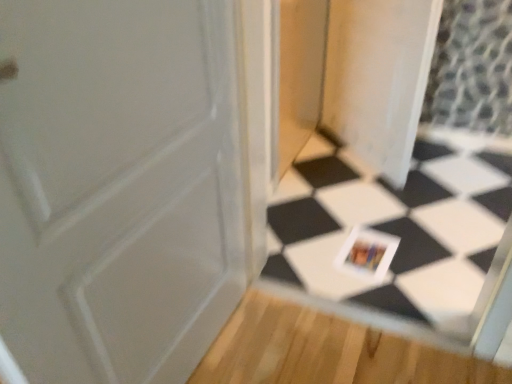
What do you see at coordinates (367, 253) in the screenshot?
I see `white glossy postcard at center` at bounding box center [367, 253].

What do you see at coordinates (396, 227) in the screenshot? This screenshot has height=384, width=512. I see `white glossy tile at center` at bounding box center [396, 227].

Image resolution: width=512 pixels, height=384 pixels. I want to click on transparent plastic screen door at center, so click(378, 78).

Is white glossy tile at center positioned with its back to white glossy postcard at center?

Yes, white glossy postcard at center is at the back of white glossy tile at center.

Is white glossy tile at center surrounding white glossy postcard at center?

Actually, white glossy postcard at center is outside white glossy tile at center.

Which object is positioned more to the right, white glossy tile at center or white glossy postcard at center?

white glossy postcard at center.

From the picture: In terms of height, does white glossy tile at center look taller or shorter compared to white glossy postcard at center?

Clearly, white glossy tile at center is taller compared to white glossy postcard at center.

Is white glossy tile at center bigger than transparent plastic screen door at center?

Indeed, white glossy tile at center has a larger size compared to transparent plastic screen door at center.

Does white glossy tile at center have a greater height compared to transparent plastic screen door at center?

Yes, white glossy tile at center is taller than transparent plastic screen door at center.

Considering the relative positions of white glossy tile at center and transparent plastic screen door at center in the image provided, is white glossy tile at center to the right of transparent plastic screen door at center from the viewer's perspective?

Incorrect, white glossy tile at center is not on the right side of transparent plastic screen door at center.

From the image's perspective, which one is positioned lower, white glossy tile at center or transparent plastic screen door at center?

From the image's view, white glossy tile at center is below.

This screenshot has width=512, height=384. I want to click on postcard behind the transparent plastic screen door at center, so click(x=367, y=253).

Could you tell me if white glossy postcard at center is turned towards transparent plastic screen door at center?

No, white glossy postcard at center is not aimed at transparent plastic screen door at center.

Based on the photo, considering the relative positions of white glossy postcard at center and transparent plastic screen door at center in the image provided, is white glossy postcard at center behind transparent plastic screen door at center?

That is True.

Measure the distance from white glossy postcard at center to transparent plastic screen door at center.

The distance of white glossy postcard at center from transparent plastic screen door at center is 78.05 centimeters.

Is transparent plastic screen door at center not near white glossy tile at center?

That's not correct — transparent plastic screen door at center is a little close to white glossy tile at center.

From the picture: Is transparent plastic screen door at center not within white glossy tile at center?

transparent plastic screen door at center lies outside white glossy tile at center's area.

From a real-world perspective, is transparent plastic screen door at center located beneath white glossy tile at center?

Yes, from a real-world perspective, transparent plastic screen door at center is below white glossy tile at center.

From the image's perspective, who appears lower, transparent plastic screen door at center or white glossy tile at center?

From the image's view, white glossy tile at center is below.

Is transparent plastic screen door at center touching white glossy postcard at center?

No, transparent plastic screen door at center is not in contact with white glossy postcard at center.

Looking at this image, which object is further away from the camera taking this photo, transparent plastic screen door at center or white glossy postcard at center?

white glossy postcard at center.

Between transparent plastic screen door at center and white glossy postcard at center, which one has smaller width?

transparent plastic screen door at center is thinner.

Who is smaller, transparent plastic screen door at center or white glossy postcard at center?

white glossy postcard at center is smaller.

Is white glossy postcard at center smaller than white glossy tile at center?

Indeed, white glossy postcard at center has a smaller size compared to white glossy tile at center.

Looking at this image, can you confirm if white glossy postcard at center is wider than white glossy tile at center?

Correct, the width of white glossy postcard at center exceeds that of white glossy tile at center.

Locate an element on the screen. Image resolution: width=512 pixels, height=384 pixels. postcard lying on the right of white glossy tile at center is located at coordinates (367, 253).

Where is `square that is above the white glossy postcard at center (from the image's perspective)`? The height and width of the screenshot is (384, 512). square that is above the white glossy postcard at center (from the image's perspective) is located at coordinates (396, 227).

Locate an element on the screen. screen door on the right side of white glossy tile at center is located at coordinates (378, 78).

Based on their spatial positions, is transparent plastic screen door at center or white glossy tile at center closer to white glossy postcard at center?

Among the two, white glossy tile at center is located nearer to white glossy postcard at center.

Consider the image. Based on their spatial positions, is white glossy tile at center or transparent plastic screen door at center closer to white glossy postcard at center?

white glossy tile at center is positioned closer to the anchor white glossy postcard at center.

Looking at the image, which one is located closer to white glossy tile at center, white glossy postcard at center or transparent plastic screen door at center?

white glossy postcard at center lies closer to white glossy tile at center than the other object.

When comparing their distances from white glossy tile at center, does transparent plastic screen door at center or white glossy postcard at center seem further?

transparent plastic screen door at center is further to white glossy tile at center.

From the picture: When comparing their distances from transparent plastic screen door at center, does white glossy postcard at center or white glossy tile at center seem further?

white glossy postcard at center is further to transparent plastic screen door at center.

Considering their positions, is white glossy tile at center positioned further to transparent plastic screen door at center than white glossy postcard at center?

white glossy postcard at center is positioned further to the anchor transparent plastic screen door at center.

Where is `screen door located between white glossy tile at center and white glossy postcard at center in the depth direction`? The image size is (512, 384). screen door located between white glossy tile at center and white glossy postcard at center in the depth direction is located at coordinates (378, 78).